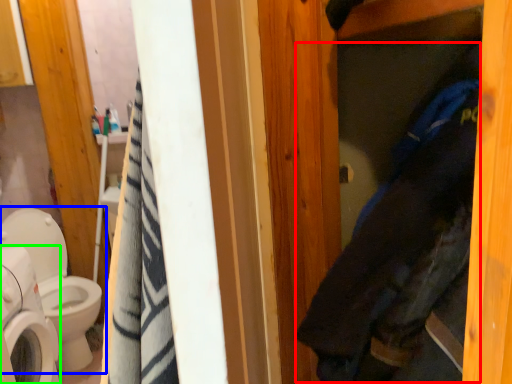
Question: Which object is positioned farthest from clothing (highlighted by a red box)? Select from toilet (highlighted by a blue box) and washing machine (highlighted by a green box).

Choices:
 (A) toilet
 (B) washing machine

Answer: (A)